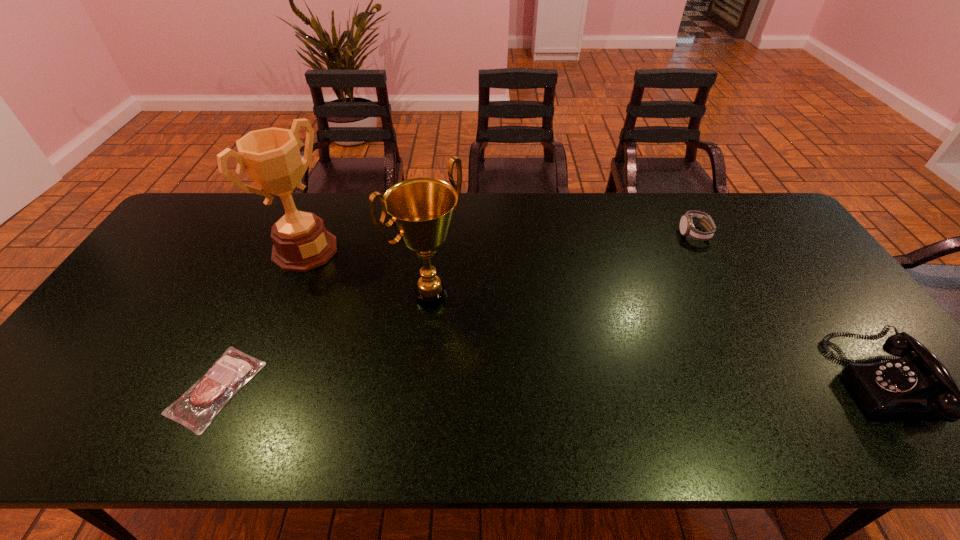
Identify the location of the shortest object. The width and height of the screenshot is (960, 540). (197, 407).

Find the location of a particular element. The width and height of the screenshot is (960, 540). the second shortest object is located at coordinates (687, 229).

The height and width of the screenshot is (540, 960). I want to click on the fourth object from left to right, so click(687, 229).

The height and width of the screenshot is (540, 960). In order to click on the left award in this screenshot , I will do `click(271, 156)`.

Find the location of a particular element. The image size is (960, 540). the third object from right to left is located at coordinates (421, 210).

The height and width of the screenshot is (540, 960). Identify the location of blank area located on the right of the steak. (427, 388).

The image size is (960, 540). Identify the location of free spot located 0.190m on the face of the watch. (665, 275).

I want to click on free space located on the face of the watch, so click(x=643, y=304).

Locate an element on the screen. vacant region located 0.290m on the face of the watch is located at coordinates (651, 294).

Locate an element on the screen. Image resolution: width=960 pixels, height=540 pixels. free space located on the front-facing side of the left award is located at coordinates (372, 300).